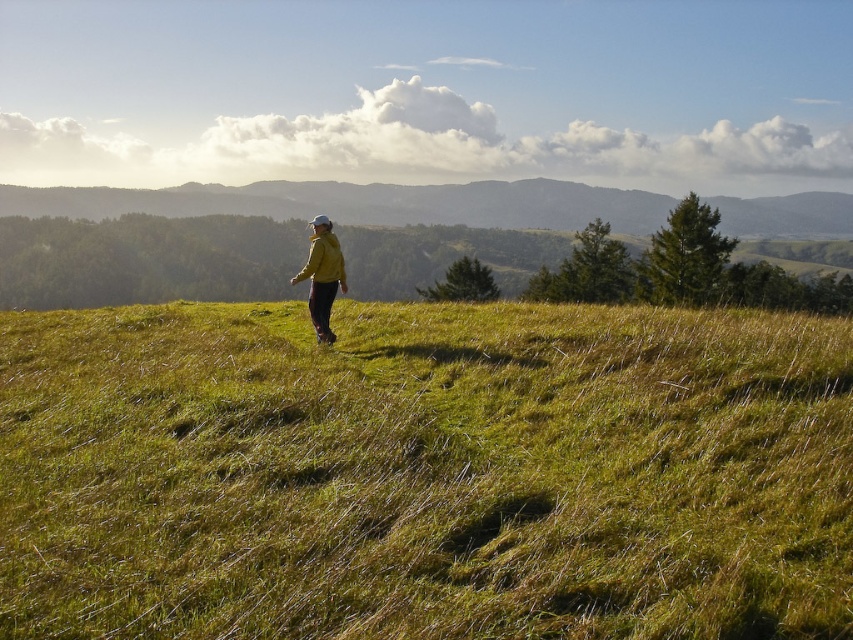
Question: Can you confirm if green grassy hillside at center is positioned to the left of yellow matte jacket at center?

Choices:
 (A) no
 (B) yes

Answer: (A)

Question: Can you confirm if green grassy hillside at center is positioned below yellow matte jacket at center?

Choices:
 (A) no
 (B) yes

Answer: (B)

Question: Which of the following is the farthest from the observer?

Choices:
 (A) green grassy hillside at center
 (B) yellow matte jacket at center

Answer: (B)

Question: Considering the relative positions of green grassy hillside at center and yellow matte jacket at center in the image provided, where is green grassy hillside at center located with respect to yellow matte jacket at center?

Choices:
 (A) below
 (B) above

Answer: (A)

Question: Which point is farther to the camera?

Choices:
 (A) (379, 452)
 (B) (345, 280)
 (C) (334, 246)

Answer: (B)

Question: Which is farther from the green grassy hillside at center?

Choices:
 (A) matte yellow jacket at center
 (B) yellow matte jacket at center

Answer: (B)